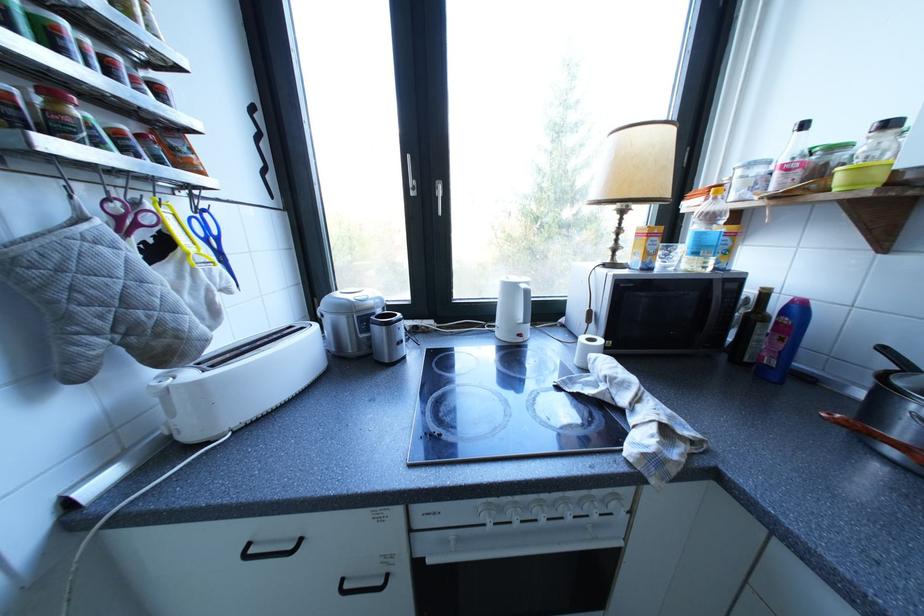
Describe the element at coordinates (517, 553) in the screenshot. I see `the oven door handle` at that location.